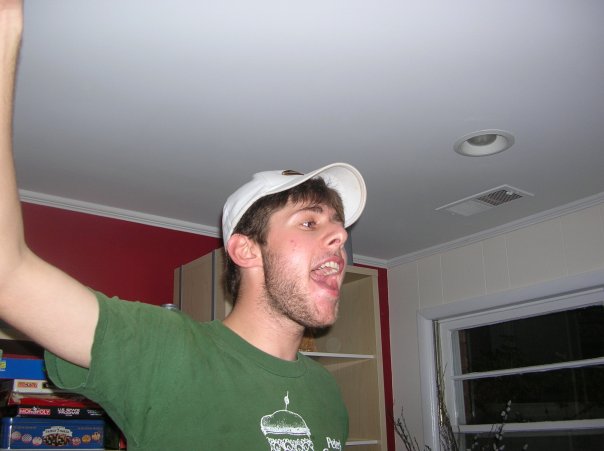
This screenshot has height=451, width=604. I want to click on board games, so click(28, 368), click(24, 385), click(40, 399), click(43, 410), click(37, 425).